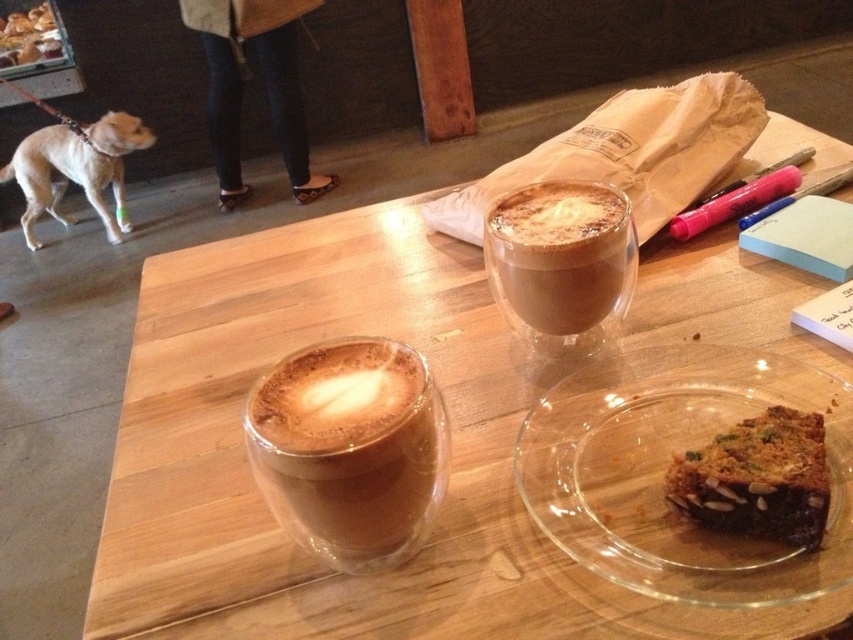
Question: Considering the relative positions of cappuccino glass at center and light brown fur at left in the image provided, where is cappuccino glass at center located with respect to light brown fur at left?

Choices:
 (A) right
 (B) left

Answer: (A)

Question: Among these points, which one is farthest from the camera?

Choices:
 (A) (577, 528)
 (B) (743, 504)

Answer: (A)

Question: Can you confirm if cappuccino glass at center is positioned above light brown fur at left?

Choices:
 (A) yes
 (B) no

Answer: (B)

Question: Which object is positioned closest to the light brown fur at left?

Choices:
 (A) matte glass cup at upper center
 (B) clear glass plate at lower right
 (C) chocolate cake at center

Answer: (A)

Question: Which of these objects is positioned closest to the light brown fur at left?

Choices:
 (A) matte glass cup at upper center
 (B) cappuccino glass at center
 (C) clear glass plate at lower right

Answer: (A)

Question: Does clear glass plate at lower right have a smaller size compared to matte glass cup at upper center?

Choices:
 (A) no
 (B) yes

Answer: (A)